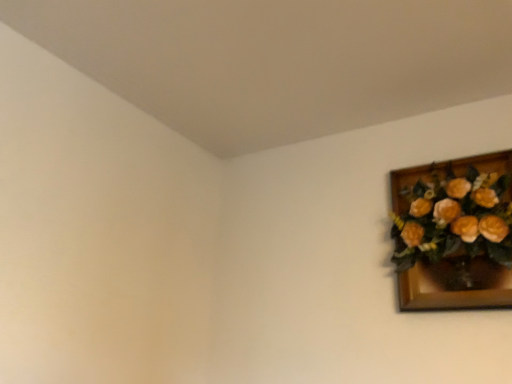
Where is `wooden picture frame at upper right`? The image size is (512, 384). wooden picture frame at upper right is located at coordinates (454, 232).

Describe the element at coordinates (454, 232) in the screenshot. This screenshot has width=512, height=384. I see `wooden picture frame at upper right` at that location.

You are a GUI agent. You are given a task and a screenshot of the screen. Output one action in this format:
    pyautogui.click(x=<x>, y=<y>)
    Task: Click on the wooden picture frame at upper right
    Image resolution: width=512 pixels, height=384 pixels.
    Given the screenshot: What is the action you would take?
    pyautogui.click(x=454, y=232)